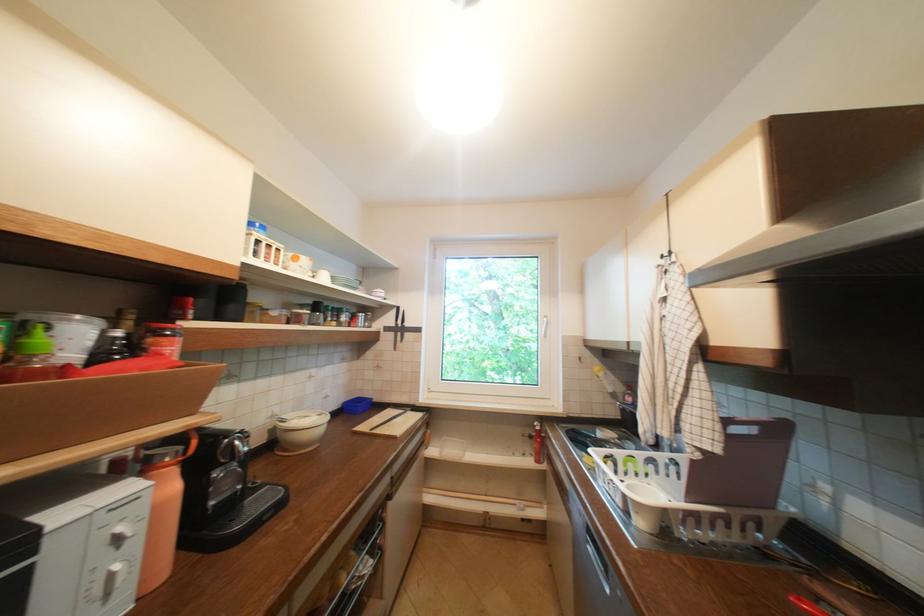
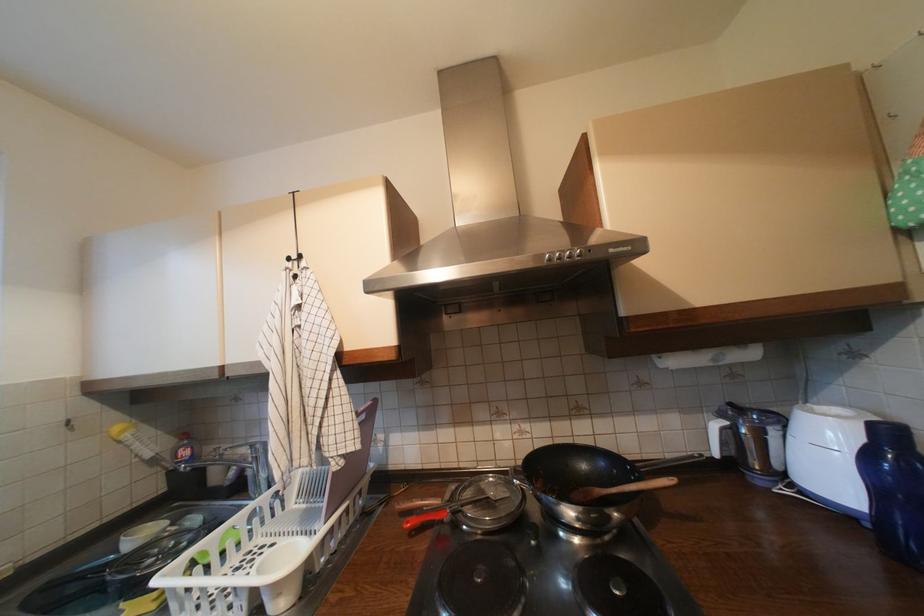
Locate, in the second image, the point that corresponds to point (636, 391) in the first image.

(189, 440)